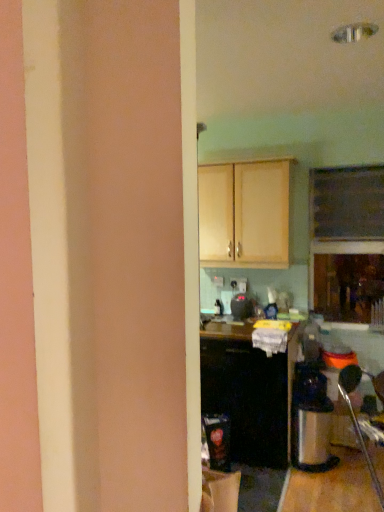
Where is `light wood cabinet at upper center, arranged as the 1th cabinetry when viewed from the top`? The image size is (384, 512). light wood cabinet at upper center, arranged as the 1th cabinetry when viewed from the top is located at coordinates (246, 214).

I want to click on black matte cabinet at center, the 2th cabinetry viewed from the top, so click(249, 392).

Which is correct: light wood cabinet at upper center, which is the 2th cabinetry from bottom to top, is inside black plastic toaster at center, or outside of it?

light wood cabinet at upper center, which is the 2th cabinetry from bottom to top, cannot be found inside black plastic toaster at center.

From a real-world perspective, is light wood cabinet at upper center, arranged as the 1th cabinetry when viewed from the top, located higher than black plastic toaster at center?

Yes.

Relative to black plastic toaster at center, is light wood cabinet at upper center, arranged as the 1th cabinetry when viewed from the top, in front or behind?

Visually, light wood cabinet at upper center, arranged as the 1th cabinetry when viewed from the top, is located in front of black plastic toaster at center.

Which is farther from the camera, (231, 312) or (270, 265)?

The point (231, 312) is farther.

How much distance is there between black plastic toaster at center and light wood cabinet at upper center, arranged as the 1th cabinetry when viewed from the top?

black plastic toaster at center and light wood cabinet at upper center, arranged as the 1th cabinetry when viewed from the top, are 27.50 inches apart.

From the image's perspective, is black plastic toaster at center located above or below light wood cabinet at upper center, arranged as the 1th cabinetry when viewed from the top?

black plastic toaster at center is below light wood cabinet at upper center, arranged as the 1th cabinetry when viewed from the top.

Would you consider black matte cabinet at center, the 2th cabinetry viewed from the top, to be distant from light wood cabinet at upper center, which is the 2th cabinetry from bottom to top?

Actually, black matte cabinet at center, the 2th cabinetry viewed from the top, and light wood cabinet at upper center, which is the 2th cabinetry from bottom to top, are a little close together.

Is black matte cabinet at center, which is the first cabinetry in bottom-to-top order, facing away from light wood cabinet at upper center, arranged as the 1th cabinetry when viewed from the top?

No, black matte cabinet at center, which is the first cabinetry in bottom-to-top order, is not facing away from light wood cabinet at upper center, arranged as the 1th cabinetry when viewed from the top.

From a real-world perspective, is black matte cabinet at center, the 2th cabinetry viewed from the top, physically above light wood cabinet at upper center, arranged as the 1th cabinetry when viewed from the top?

Actually, black matte cabinet at center, the 2th cabinetry viewed from the top, is physically below light wood cabinet at upper center, arranged as the 1th cabinetry when viewed from the top, in the real world.

Does black matte cabinet at center, which is the first cabinetry in bottom-to-top order, appear on the left side of light wood cabinet at upper center, arranged as the 1th cabinetry when viewed from the top?

No, black matte cabinet at center, which is the first cabinetry in bottom-to-top order, is not to the left of light wood cabinet at upper center, arranged as the 1th cabinetry when viewed from the top.

Is point (275, 448) less distant than point (237, 300)?

Yes, it is.

From the image's perspective, does black matte cabinet at center, the 2th cabinetry viewed from the top, appear lower than black plastic toaster at center?

Yes, from the image's perspective, black matte cabinet at center, the 2th cabinetry viewed from the top, is below black plastic toaster at center.

Considering the relative sizes of black matte cabinet at center, which is the first cabinetry in bottom-to-top order, and black plastic toaster at center in the image provided, is black matte cabinet at center, which is the first cabinetry in bottom-to-top order, taller than black plastic toaster at center?

Yes, black matte cabinet at center, which is the first cabinetry in bottom-to-top order, is taller than black plastic toaster at center.

Is point (247, 314) closer to viewer compared to point (280, 416)?

No, it is not.

Is black plastic toaster at center positioned beyond the bounds of black matte cabinet at center, which is the first cabinetry in bottom-to-top order?

Yes.

From the image's perspective, is light wood cabinet at upper center, arranged as the 1th cabinetry when viewed from the top, located beneath black matte cabinet at center, the 2th cabinetry viewed from the top?

No.

Is point (282, 259) behind point (281, 403)?

That is True.

In the image, there is a light wood cabinet at upper center, which is the 2th cabinetry from bottom to top. At what (x,y) coordinates should I click in order to perform the action: click on cabinetry below it (from a real-world perspective). Please return your answer as a coordinate pair (x, y). Looking at the image, I should click on (249, 392).

Between light wood cabinet at upper center, which is the 2th cabinetry from bottom to top, and black matte cabinet at center, the 2th cabinetry viewed from the top, which one has smaller size?

Smaller between the two is light wood cabinet at upper center, which is the 2th cabinetry from bottom to top.

You are a GUI agent. You are given a task and a screenshot of the screen. Output one action in this format:
    pyautogui.click(x=<x>, y=<y>)
    Task: Click on the appliance on the right of light wood cabinet at upper center, arranged as the 1th cabinetry when viewed from the top
    The image size is (384, 512).
    Given the screenshot: What is the action you would take?
    pyautogui.click(x=241, y=307)

Where is `appliance directly beneath the light wood cabinet at upper center, arranged as the 1th cabinetry when viewed from the top (from a real-world perspective)`? appliance directly beneath the light wood cabinet at upper center, arranged as the 1th cabinetry when viewed from the top (from a real-world perspective) is located at coordinates (241, 307).

Looking at the image, which one is located closer to light wood cabinet at upper center, arranged as the 1th cabinetry when viewed from the top, black plastic toaster at center or black matte cabinet at center, the 2th cabinetry viewed from the top?

Based on the image, black plastic toaster at center appears to be nearer to light wood cabinet at upper center, arranged as the 1th cabinetry when viewed from the top.

Estimate the real-world distances between objects in this image. Which object is further from black plastic toaster at center, black matte cabinet at center, which is the first cabinetry in bottom-to-top order, or light wood cabinet at upper center, arranged as the 1th cabinetry when viewed from the top?

light wood cabinet at upper center, arranged as the 1th cabinetry when viewed from the top, lies further to black plastic toaster at center than the other object.

Estimate the real-world distances between objects in this image. Which object is further from light wood cabinet at upper center, which is the 2th cabinetry from bottom to top, black matte cabinet at center, which is the first cabinetry in bottom-to-top order, or black plastic toaster at center?

Answer: Based on the image, black matte cabinet at center, which is the first cabinetry in bottom-to-top order, appears to be further to light wood cabinet at upper center, which is the 2th cabinetry from bottom to top.

Looking at the image, which one is located closer to black plastic toaster at center, light wood cabinet at upper center, which is the 2th cabinetry from bottom to top, or black matte cabinet at center, the 2th cabinetry viewed from the top?

black matte cabinet at center, the 2th cabinetry viewed from the top.

From the image, which object appears to be farther from black matte cabinet at center, which is the first cabinetry in bottom-to-top order, light wood cabinet at upper center, arranged as the 1th cabinetry when viewed from the top, or black plastic toaster at center?

light wood cabinet at upper center, arranged as the 1th cabinetry when viewed from the top, is further to black matte cabinet at center, which is the first cabinetry in bottom-to-top order.

Based on their spatial positions, is black plastic toaster at center or light wood cabinet at upper center, arranged as the 1th cabinetry when viewed from the top, closer to black matte cabinet at center, which is the first cabinetry in bottom-to-top order?

Among the two, black plastic toaster at center is located nearer to black matte cabinet at center, which is the first cabinetry in bottom-to-top order.

Locate an element on the screen. appliance between light wood cabinet at upper center, arranged as the 1th cabinetry when viewed from the top, and black matte cabinet at center, which is the first cabinetry in bottom-to-top order, vertically is located at coordinates (241, 307).